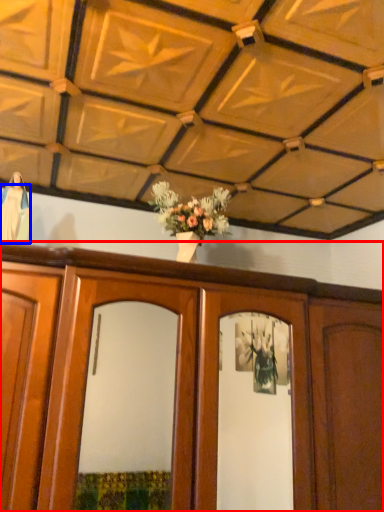
Question: Which of the following is the closest to the observer, cabinetry (highlighted by a red box) or robe (highlighted by a blue box)?

Choices:
 (A) cabinetry
 (B) robe

Answer: (A)